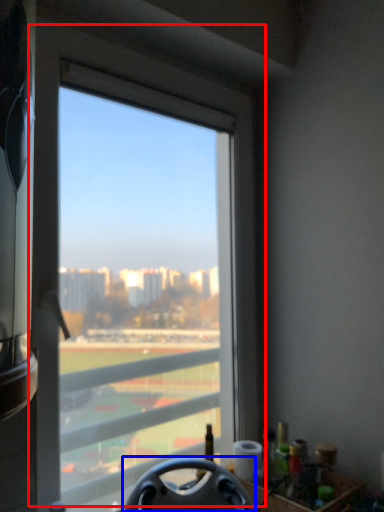
Question: Among these objects, which one is farthest to the camera, window (highlighted by a red box) or steering wheel (highlighted by a blue box)?

Choices:
 (A) window
 (B) steering wheel

Answer: (A)